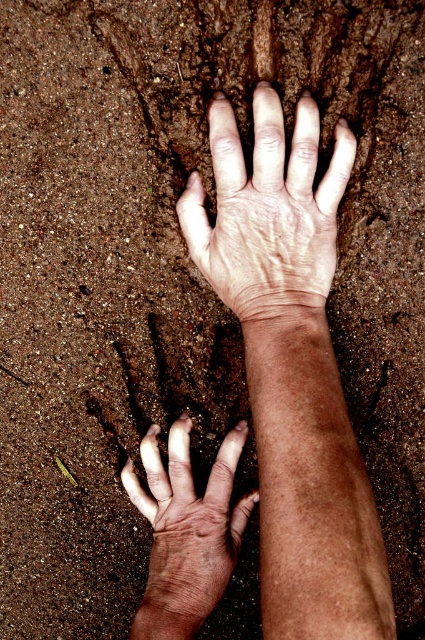
In the scene shown: Which of these two, dry skin hand at upper center or dry skin hand at lower left, stands shorter?

dry skin hand at lower left is shorter.

Who is taller, dry skin hand at upper center or dry skin hand at lower left?

dry skin hand at upper center

Between point (286, 224) and point (156, 486), which one is positioned behind?

The point (156, 486) is more distant.

You are a GUI agent. You are given a task and a screenshot of the screen. Output one action in this format:
    pyautogui.click(x=<x>, y=<y>)
    Task: Click on the dry skin hand at upper center
    This screenshot has width=425, height=640.
    Given the screenshot: What is the action you would take?
    pyautogui.click(x=268, y=208)